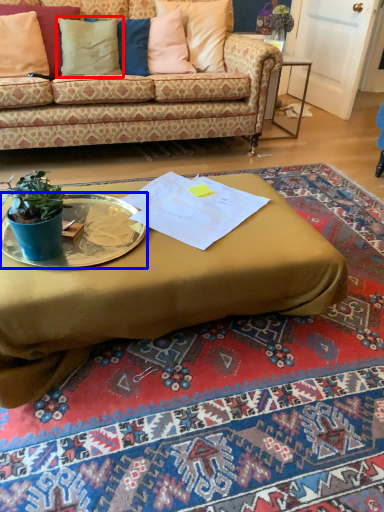
Question: Which of the following is the closest to the observer, pillow (highlighted by a red box) or platter (highlighted by a blue box)?

Choices:
 (A) pillow
 (B) platter

Answer: (B)